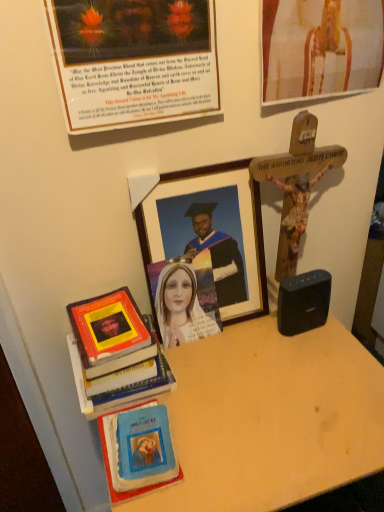
Where is `free space in front of wooden picture frame at center, which is the 1th picture frame from bottom to top`? This screenshot has height=512, width=384. free space in front of wooden picture frame at center, which is the 1th picture frame from bottom to top is located at coordinates (238, 398).